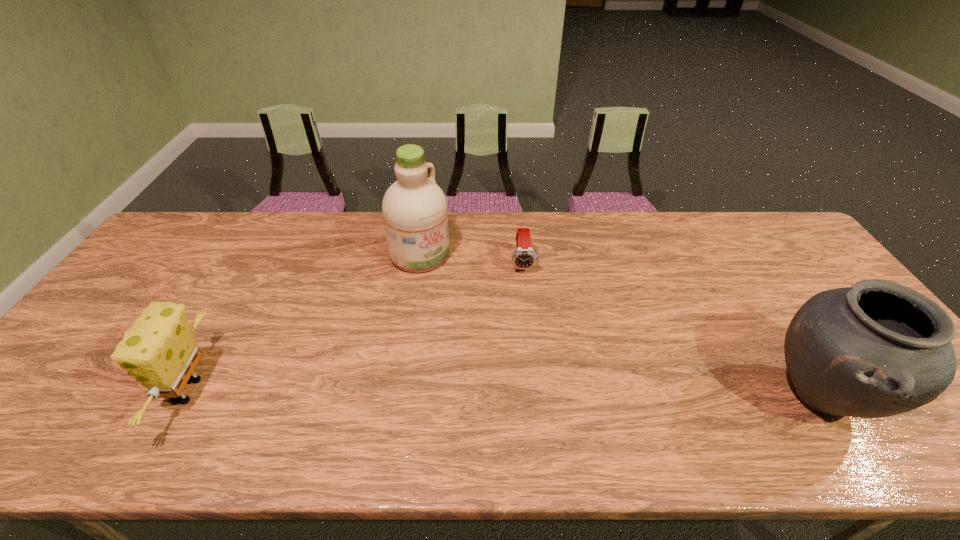
Where is `vacant area that lies between the shortest object and the leftmost object`? vacant area that lies between the shortest object and the leftmost object is located at coordinates (356, 327).

Where is `empty space that is in between the shortest object and the cleansing agent`? The height and width of the screenshot is (540, 960). empty space that is in between the shortest object and the cleansing agent is located at coordinates (471, 259).

The image size is (960, 540). What are the coordinates of `free space between the tallest object and the leftmost object` in the screenshot? It's located at (305, 322).

Where is `empty space between the urn and the cleansing agent`? This screenshot has height=540, width=960. empty space between the urn and the cleansing agent is located at coordinates (620, 325).

I want to click on vacant space that is in between the third object from right to left and the leftmost object, so click(x=305, y=322).

Identify the location of free space that is in between the cleansing agent and the third shortest object. (620, 325).

I want to click on unoccupied area between the third tallest object and the cleansing agent, so click(x=305, y=322).

You are a GUI agent. You are given a task and a screenshot of the screen. Output one action in this format:
    pyautogui.click(x=<x>, y=<y>)
    Task: Click on the empty space between the sponge and the urn
    The width and height of the screenshot is (960, 540).
    Given the screenshot: What is the action you would take?
    pyautogui.click(x=505, y=394)

This screenshot has width=960, height=540. I want to click on blank region between the rightmost object and the watch, so click(x=672, y=330).

This screenshot has height=540, width=960. I want to click on object that can be found as the third closest to the cleansing agent, so click(x=876, y=349).